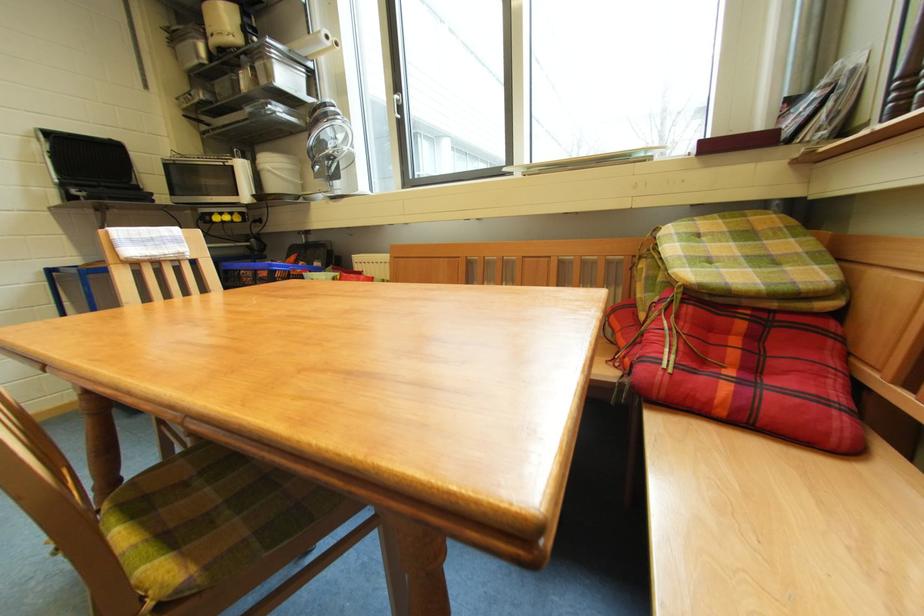
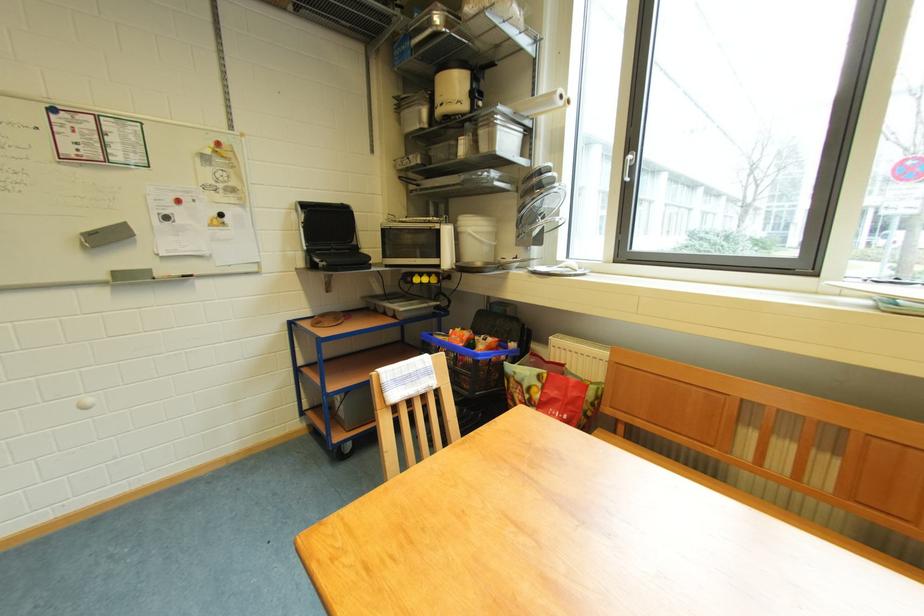
The point at (326,44) is marked in the first image. Where is the corresponding point in the second image?

(560, 103)